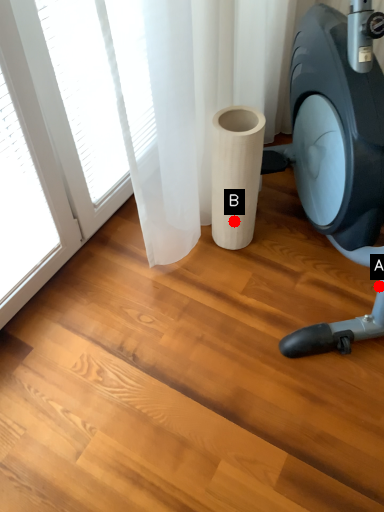
Question: Two points are circled on the image, labeled by A and B beside each circle. Which point appears farthest from the camera in this image?

Choices:
 (A) A is further
 (B) B is further

Answer: (B)